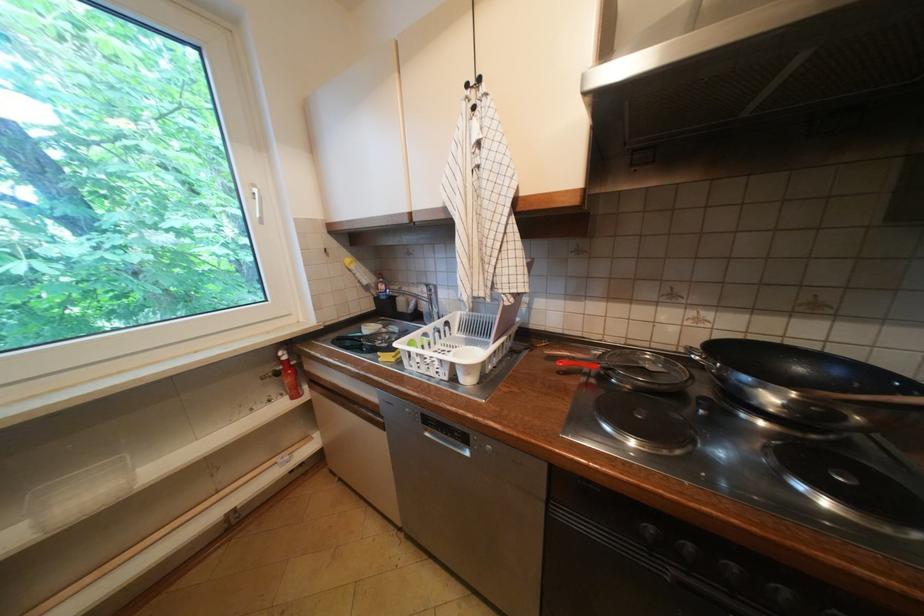
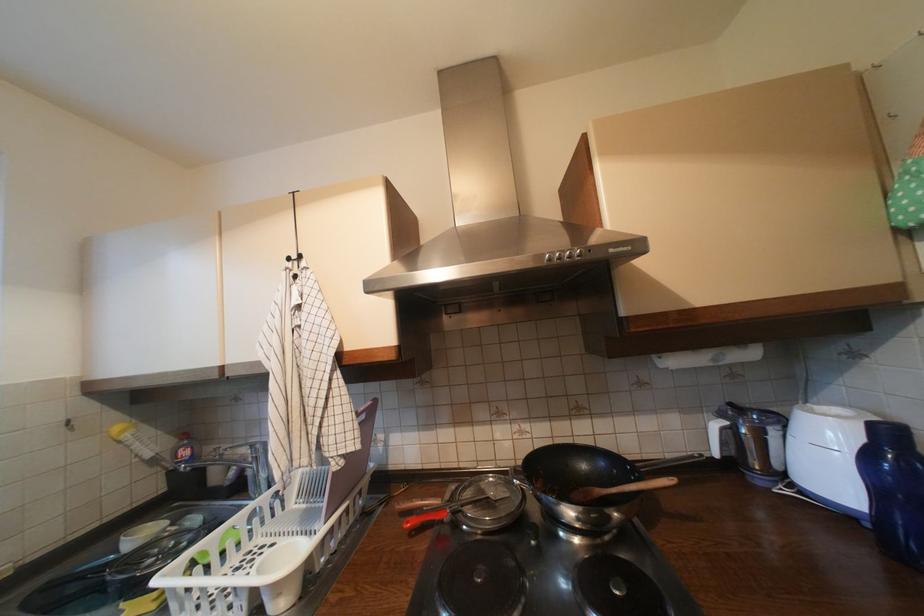
The point at (476,87) is marked in the first image. Where is the corresponding point in the second image?

(297, 260)